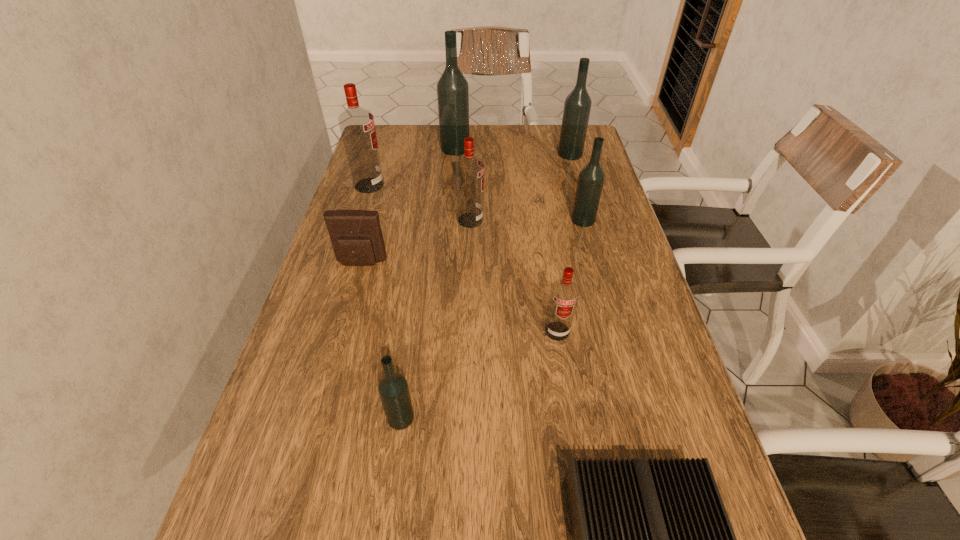
You are a GUI agent. You are given a task and a screenshot of the screen. Output one action in this format:
    pyautogui.click(x=<x>, y=<y>)
    Task: Click on the tallest vodka
    
    Given the screenshot: What is the action you would take?
    pyautogui.click(x=452, y=88)

Find the location of a particular element. the tallest object is located at coordinates (452, 88).

Where is `the fifth nearest vodka`? This screenshot has height=540, width=960. the fifth nearest vodka is located at coordinates (357, 126).

Where is `the seventh nearest object`? This screenshot has height=540, width=960. the seventh nearest object is located at coordinates (357, 126).

Identify the location of the second biggest black vodka. This screenshot has height=540, width=960. (577, 106).

Find the location of `the second smallest red vodka`. the second smallest red vodka is located at coordinates (469, 170).

What are the coordinates of `the second red vodka from right to left` in the screenshot? It's located at (469, 170).

Where is `the third biggest black vodka`? This screenshot has height=540, width=960. the third biggest black vodka is located at coordinates (591, 178).

In order to click on the third nearest object in this screenshot , I will do `click(564, 293)`.

Where is `the sixth farthest vodka`? the sixth farthest vodka is located at coordinates (564, 293).